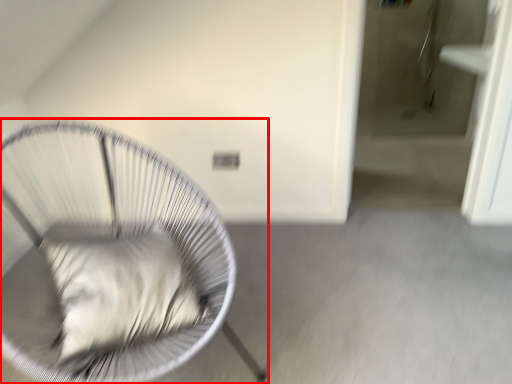
Question: In this image, where is furniture (annotated by the red box) located relative to pillow?

Choices:
 (A) right
 (B) left

Answer: (B)